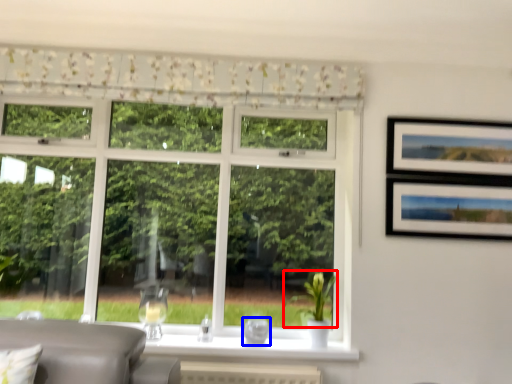
Question: Which object appears farthest to the camera in this image, plant (highlighted by a red box) or glass vase (highlighted by a blue box)?

Choices:
 (A) plant
 (B) glass vase

Answer: (B)